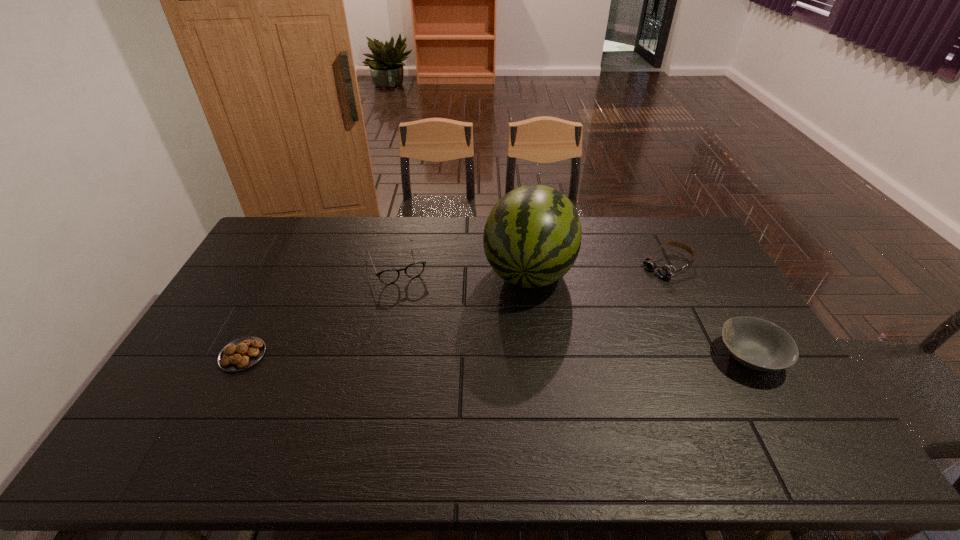
Where is `vacant point at the far right corner`? vacant point at the far right corner is located at coordinates (665, 235).

Identify the location of blank region between the goggles and the tallest object. Image resolution: width=960 pixels, height=540 pixels. (598, 268).

The width and height of the screenshot is (960, 540). In order to click on free space between the watermelon and the fourth shortest object in this screenshot , I will do `click(639, 314)`.

Where is `vacant area that lies between the bowl and the watermelon`? Image resolution: width=960 pixels, height=540 pixels. vacant area that lies between the bowl and the watermelon is located at coordinates (639, 314).

At what (x,y) coordinates should I click in order to perform the action: click on unoccupied area between the third object from left to right and the goggles. Please return your answer as a coordinate pair (x, y). This screenshot has height=540, width=960. Looking at the image, I should click on (x=598, y=268).

Where is `empty space that is in between the second tallest object and the tallest object`? This screenshot has width=960, height=540. empty space that is in between the second tallest object and the tallest object is located at coordinates (639, 314).

At what (x,y) coordinates should I click in order to perform the action: click on empty space between the watermelon and the bowl. Please return your answer as a coordinate pair (x, y). This screenshot has height=540, width=960. Looking at the image, I should click on (639, 314).

You are a GUI agent. You are given a task and a screenshot of the screen. Output one action in this format:
    pyautogui.click(x=<x>, y=<y>)
    Task: Click on the vacant point located between the goggles and the third object from right to left
    Image resolution: width=960 pixels, height=540 pixels.
    Given the screenshot: What is the action you would take?
    click(x=598, y=268)

Where is `free spot between the pastry and the tallest object`? free spot between the pastry and the tallest object is located at coordinates (386, 313).

Where is `empty space that is in between the third object from right to left and the shortest object`? The height and width of the screenshot is (540, 960). empty space that is in between the third object from right to left and the shortest object is located at coordinates (386, 313).